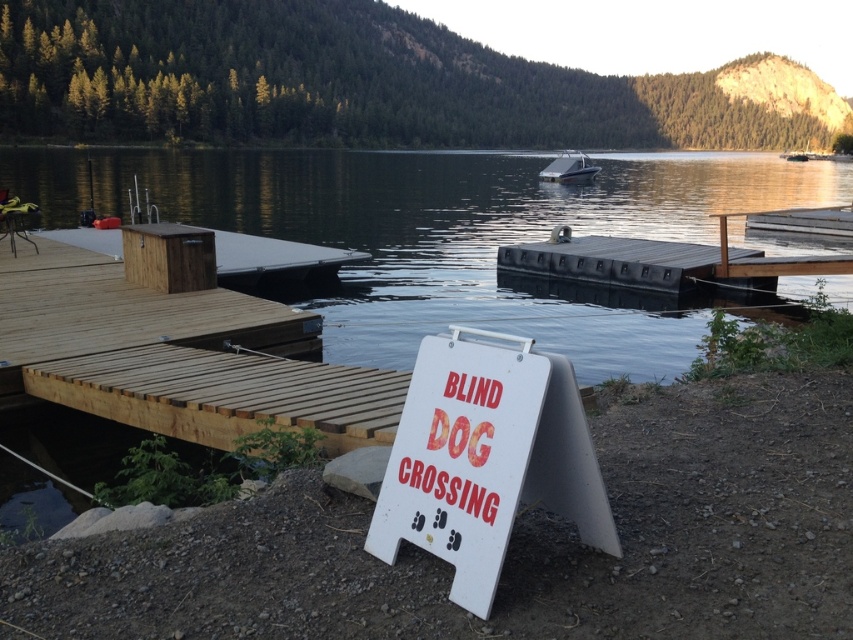
Between transparent water at center and white paper sign at center, which one has less height?

white paper sign at center

Is transparent water at center taller than white paper sign at center?

Correct, transparent water at center is much taller as white paper sign at center.

Identify the location of transparent water at center. The height and width of the screenshot is (640, 853). (469, 237).

Does transparent water at center come behind white glossy boat at center?

No, transparent water at center is closer to the viewer.

Between point (254, 211) and point (567, 179), which one is positioned behind?

The point (567, 179) is behind.

Is point (569, 323) less distant than point (566, 173)?

Yes, point (569, 323) is in front of point (566, 173).

Identify the location of transparent water at center. The width and height of the screenshot is (853, 640). pos(469,237).

Does point (537, 394) come farther from viewer compared to point (553, 161)?

That is False.

Which of these two, white paper sign at center or white glossy boat at center, stands shorter?

Standing shorter between the two is white paper sign at center.

Measure the distance between white paper sign at center and camera.

white paper sign at center is 8.88 feet from camera.

Where is `white paper sign at center`? white paper sign at center is located at coordinates (461, 458).